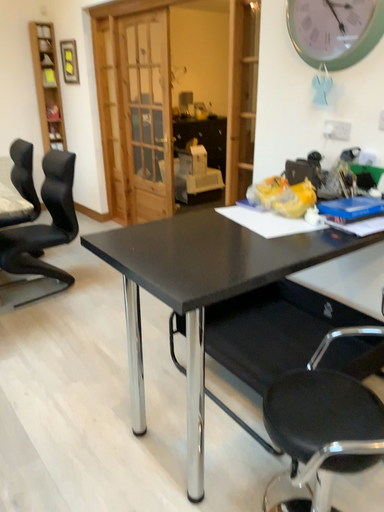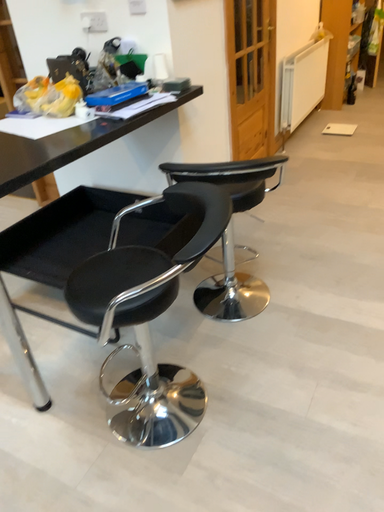
Question: How did the camera likely rotate when shooting the video?

Choices:
 (A) rotated downward
 (B) rotated upward

Answer: (A)